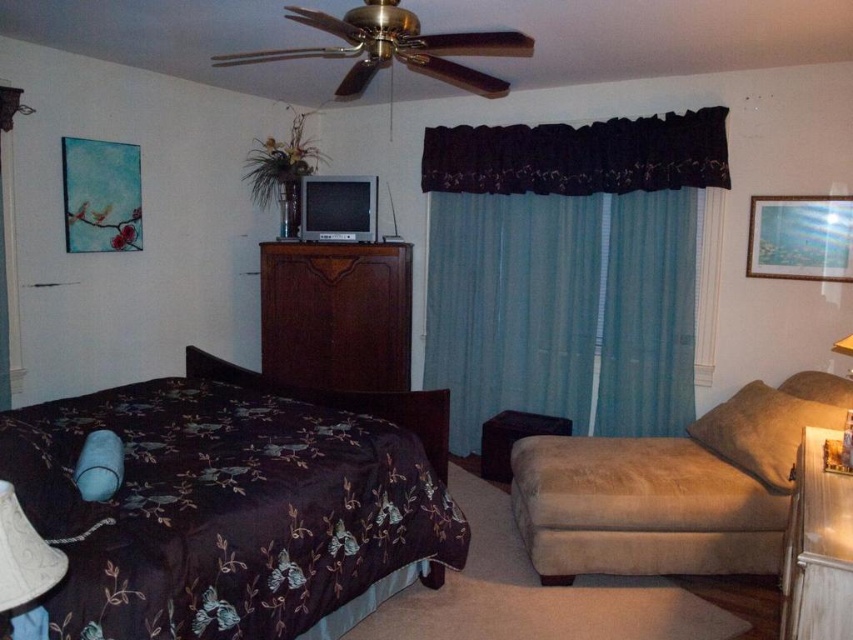
Question: Among these objects, which one is farthest from the camera?

Choices:
 (A) teal fabric curtain at center
 (B) dark wood dresser at center
 (C) suede ottoman at lower right
 (D) white fabric lampshade at lower left

Answer: (B)

Question: Which of the following is the farthest from the observer?

Choices:
 (A) (323, 486)
 (B) (585, 464)

Answer: (B)

Question: Where is suede ottoman at lower right located in relation to white fabric lampshade at lower left in the image?

Choices:
 (A) right
 (B) left

Answer: (A)

Question: Is suede ottoman at lower right below dark wood dresser at center?

Choices:
 (A) yes
 (B) no

Answer: (A)

Question: Is teal fabric curtain at center thinner than dark wood dresser at center?

Choices:
 (A) yes
 (B) no

Answer: (B)

Question: Among these points, which one is nearest to the camera?

Choices:
 (A) (27, 637)
 (B) (546, 449)
 (C) (404, 348)
 (D) (165, 458)

Answer: (A)